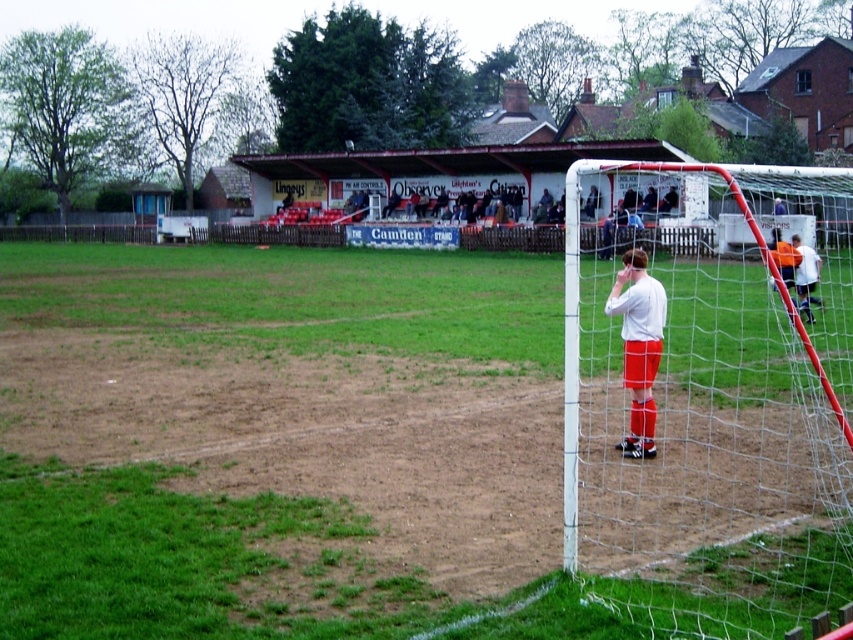
Does green grass at lower left have a greater height compared to white mesh net at right?

In fact, green grass at lower left may be shorter than white mesh net at right.

Does point (352, 408) come in front of point (589, 204)?

Yes, it is.

Locate an element on the screen. The height and width of the screenshot is (640, 853). green grass at lower left is located at coordinates (231, 420).

What do you see at coordinates (708, 397) in the screenshot? The image size is (853, 640). I see `white mesh net at right` at bounding box center [708, 397].

Between white mesh net at right and white matte shirt at right, which one is positioned higher?

Positioned higher is white mesh net at right.

Describe the element at coordinates (708, 397) in the screenshot. I see `white mesh net at right` at that location.

You are a GUI agent. You are given a task and a screenshot of the screen. Output one action in this format:
    pyautogui.click(x=<x>, y=<y>)
    Task: Click on the white mesh net at right
    This screenshot has width=853, height=640.
    Given the screenshot: What is the action you would take?
    pyautogui.click(x=708, y=397)

From the picture: Who is more forward, (502, 365) or (647, 330)?

Point (647, 330) is in front.

Does green grass at lower left have a greater width compared to white matte shirt at right?

Indeed, green grass at lower left has a greater width compared to white matte shirt at right.

Image resolution: width=853 pixels, height=640 pixels. Identify the location of green grass at lower left. (231, 420).